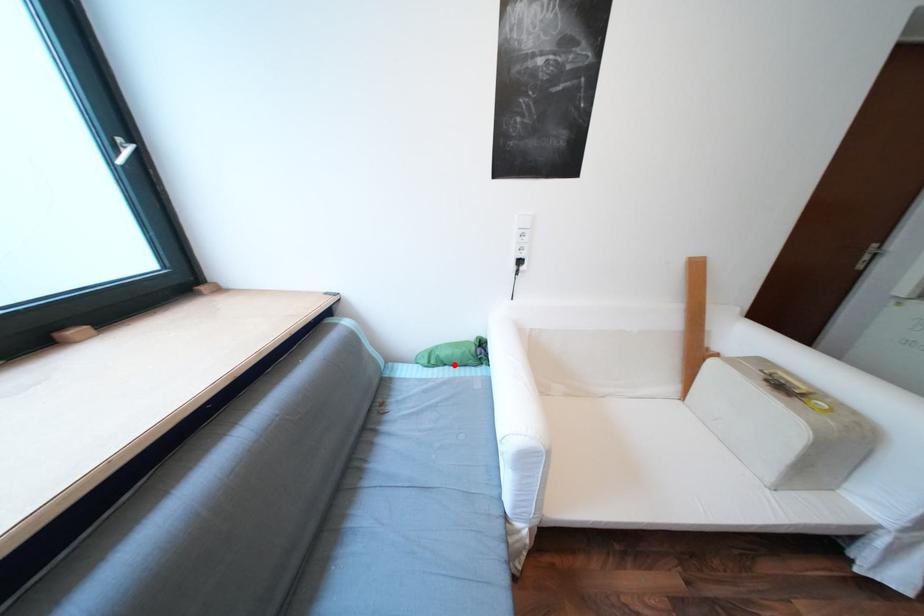
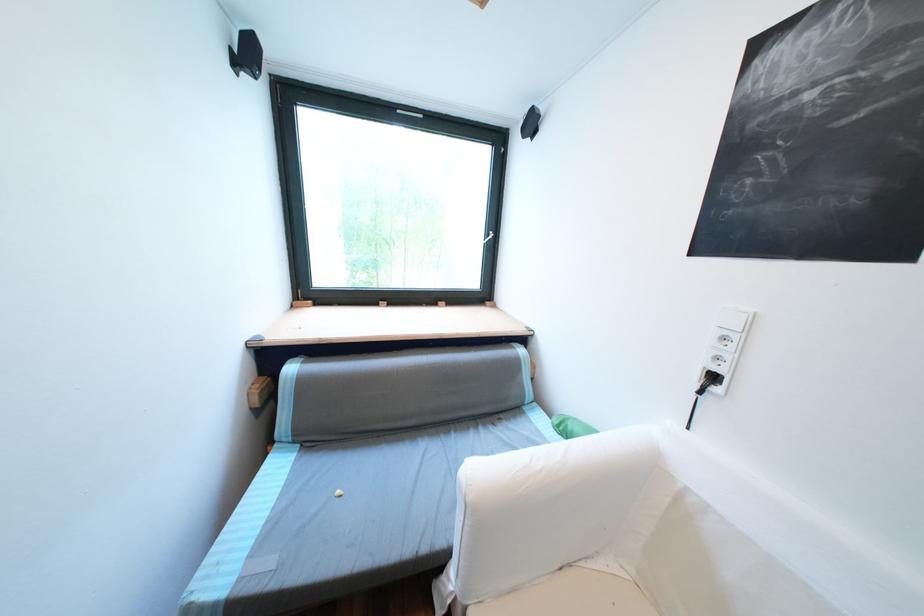
Where in the second image is the point corresponding to the highlighted location from the first image?

(578, 440)